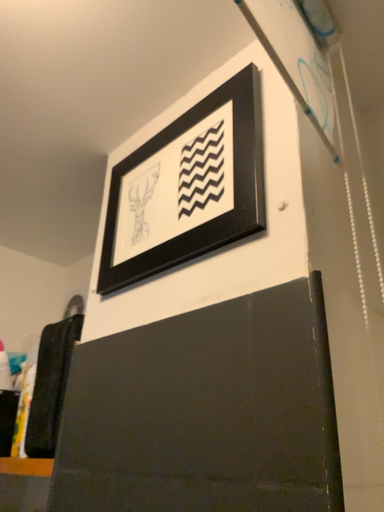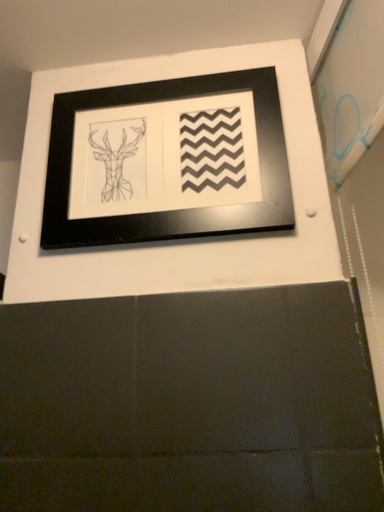
Question: How did the camera likely rotate when shooting the video?

Choices:
 (A) rotated left
 (B) rotated right

Answer: (B)